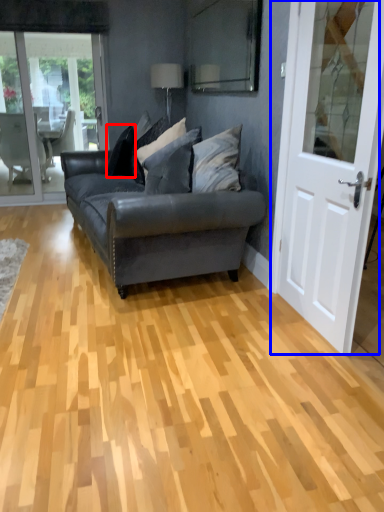
Question: Which of the following is the closest to the observer, pillow (highlighted by a red box) or door (highlighted by a blue box)?

Choices:
 (A) pillow
 (B) door

Answer: (B)